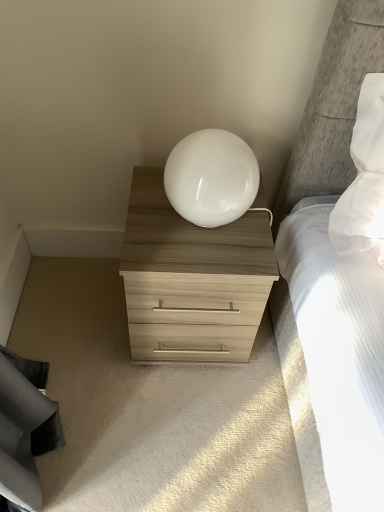
Where is `free space in front of white glossy sphere at center`? The height and width of the screenshot is (512, 384). free space in front of white glossy sphere at center is located at coordinates (200, 259).